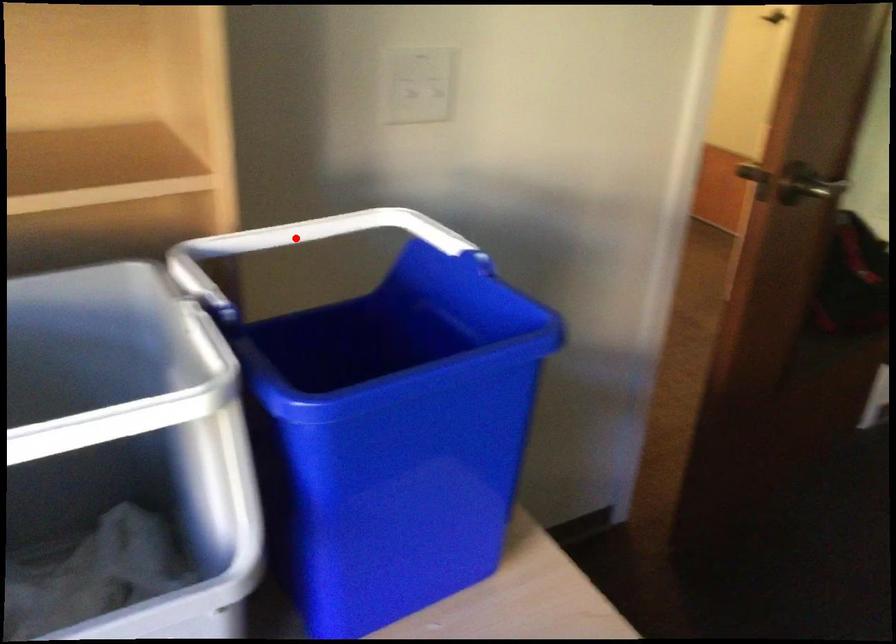
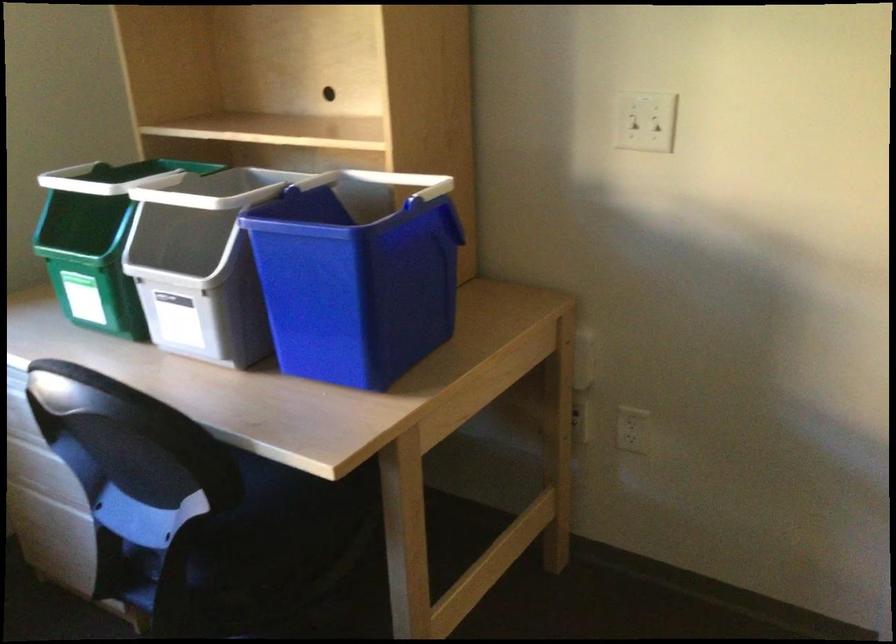
Question: I am providing you with two images of the same scene from different viewpoints. In image1, a red point is highlighted. Considering the same 3D point in image2, which of the following is correct?

Choices:
 (A) It is closer
 (B) It is farther

Answer: (B)